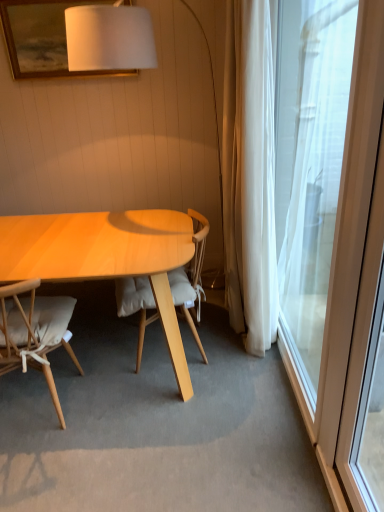
I want to click on vacant space in front of light brown wood chair at left, which ranks as the second chair in right-to-left order, so click(x=49, y=474).